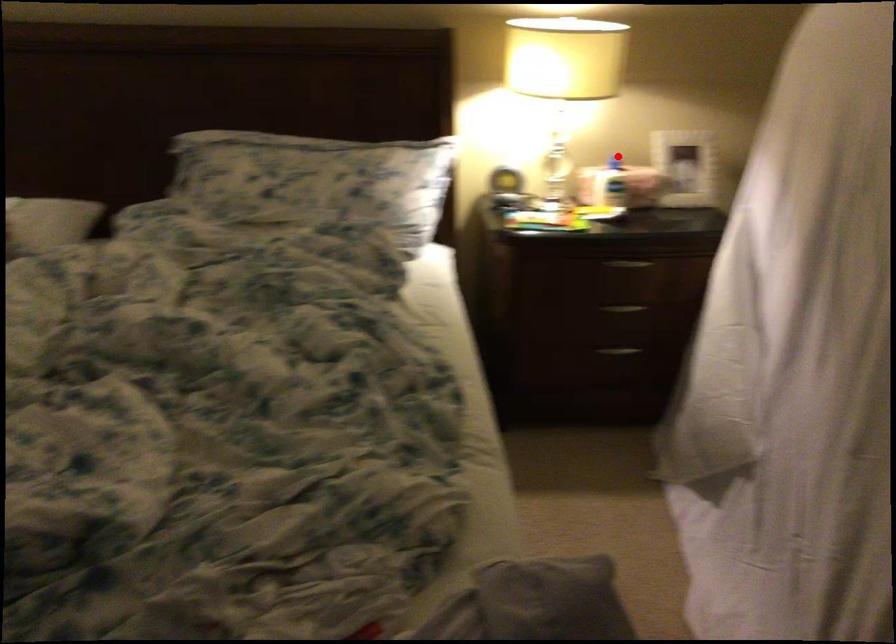
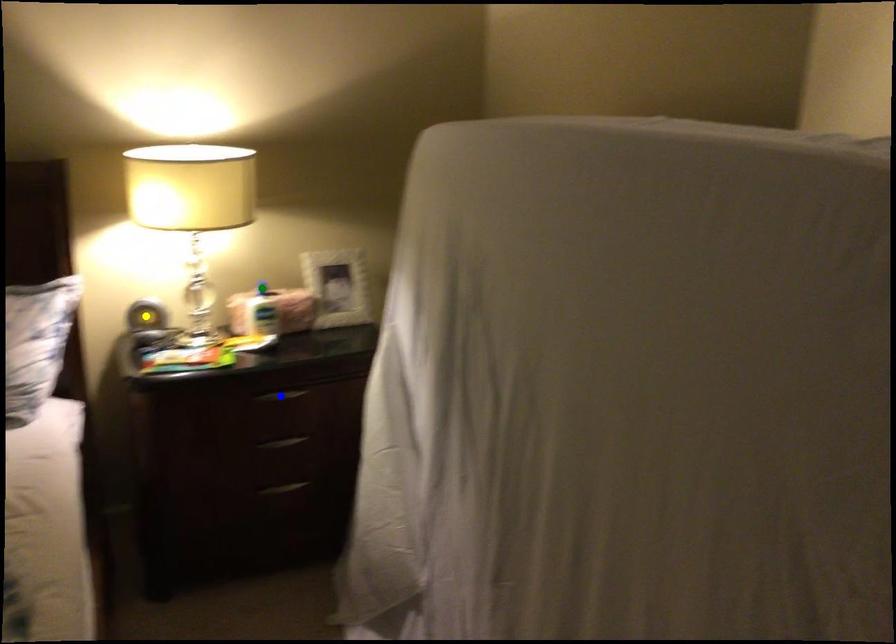
Question: I am providing you with two images of the same scene from different viewpoints. A red point is marked on the first image. You are given multiple points on the second image. Can you choose the point in image 2 that corresponds to the point in image 1?

Choices:
 (A) yellow point
 (B) blue point
 (C) green point

Answer: (C)